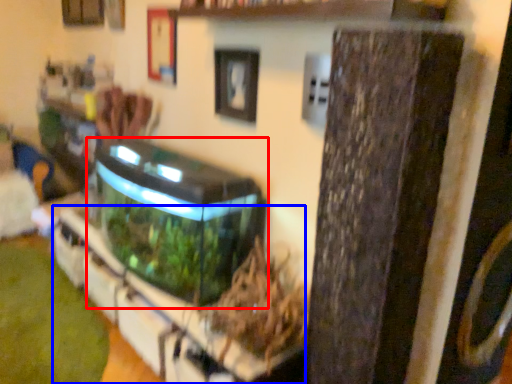
Question: Which point is further to the camera, water tank (highlighted by a red box) or shelf (highlighted by a blue box)?

Choices:
 (A) water tank
 (B) shelf

Answer: (A)